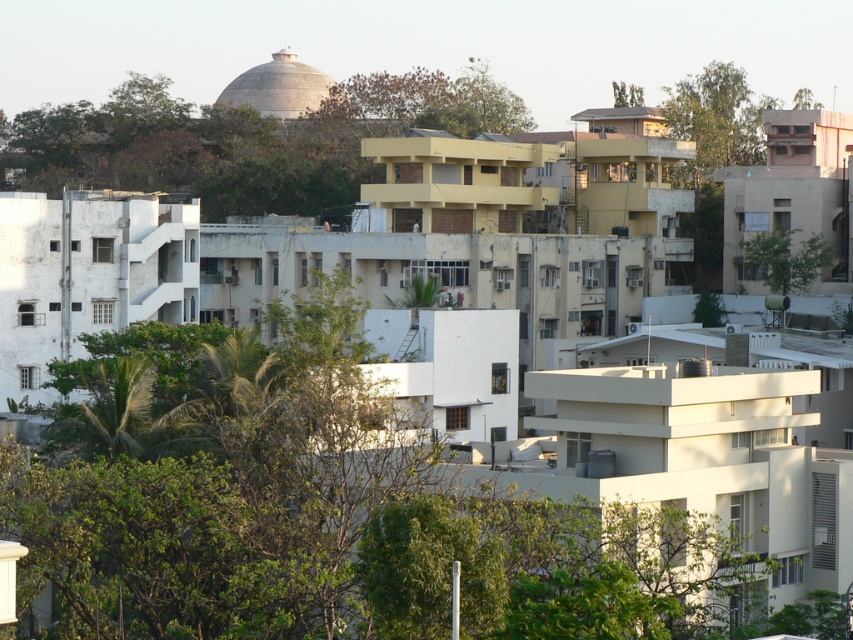
You are a drone operator trying to navigate between the brown leafy tree at upper center and the green leafy tree at right. Which tree should you fly over first to stay closer to the viewer?

You should fly over the brown leafy tree at upper center first because it is closer to the viewer than the green leafy tree at right.

Based on the scene description, where is the brown leafy tree at upper center located in terms of coordinates?

The brown leafy tree at upper center is located at coordinates point (248,140).